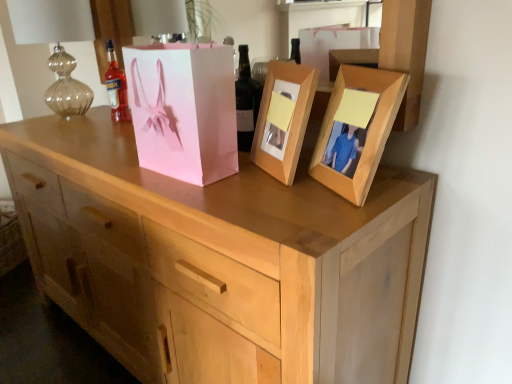
The image size is (512, 384). I want to click on vacant area that is situated to the right of pink paper bag at center, so click(x=259, y=184).